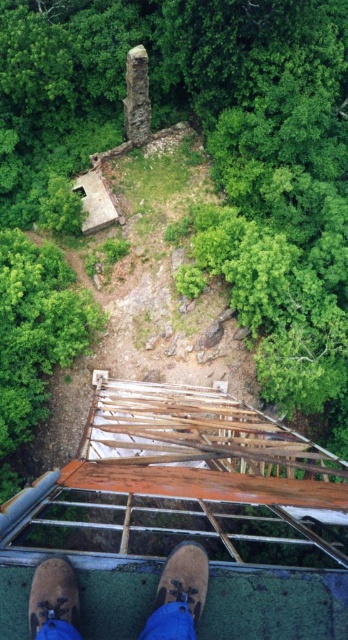
Question: Estimate the real-world distances between objects in this image. Which object is closer to the brown leather shoes at center?

Choices:
 (A) brown suede shoe at lower left
 (B) brown suede shoe at lower center

Answer: (B)

Question: Can you confirm if brown leather shoes at center is smaller than brown suede shoe at lower left?

Choices:
 (A) yes
 (B) no

Answer: (B)

Question: Is brown suede shoe at lower center above brown suede shoe at lower left?

Choices:
 (A) no
 (B) yes

Answer: (A)

Question: Among these objects, which one is nearest to the camera?

Choices:
 (A) brown leather shoes at center
 (B) brown suede shoe at lower center

Answer: (A)

Question: Estimate the real-world distances between objects in this image. Which object is farther from the brown leather shoes at center?

Choices:
 (A) brown suede shoe at lower center
 (B) brown suede shoe at lower left

Answer: (B)

Question: Can you confirm if brown leather shoes at center is positioned to the left of brown suede shoe at lower left?

Choices:
 (A) no
 (B) yes

Answer: (A)